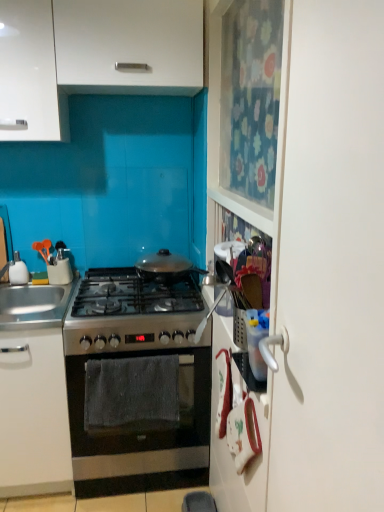
In order to face satin silver oven at center, which is counted as the 3th cabinetry, starting from the top, should I rotate leftwards or rightwards?

To face it directly, rotate left by 21.306 degrees.

Identify the location of white glossy soap dispenser at left. click(x=18, y=271).

In order to face stainless steel gas stove at center, should I rotate leftwards or rightwards?

You should rotate left by 7.017 degrees.

What do you see at coordinates (30, 74) in the screenshot? I see `white glossy cabinet at upper left, which is the 2th cabinetry from bottom to top` at bounding box center [30, 74].

Find the location of `satin silver oven at center, the first cabinetry in the bottom-to-top sequence`. satin silver oven at center, the first cabinetry in the bottom-to-top sequence is located at coordinates (34, 414).

Considering the positions of objects white glossy soap dispenser at left and silver metallic sink at left in the image provided, who is more to the left, white glossy soap dispenser at left or silver metallic sink at left?

white glossy soap dispenser at left is more to the left.

Is white glossy soap dispenser at left in front of silver metallic sink at left?

No.

From a real-world perspective, which object rests below the other?

From a 3D spatial view, silver metallic sink at left is below.

Is white glossy soap dispenser at left shorter than silver metallic sink at left?

Incorrect, the height of white glossy soap dispenser at left does not fall short of that of silver metallic sink at left.

Which object is further away from the camera taking this photo, stainless steel gas stove at center or silver metallic sink at left?

silver metallic sink at left.

Between stainless steel gas stove at center and silver metallic sink at left, which one has smaller size?

silver metallic sink at left is smaller.

Does point (184, 345) appear closer or farther from the camera than point (10, 328)?

Point (184, 345) is farther from the camera than point (10, 328).

From a real-world perspective, is stainless steel gas stove at center below silver metallic sink at left?

Incorrect, from a real-world perspective, stainless steel gas stove at center is higher than silver metallic sink at left.

Locate an element on the screen. cabinetry that is the 1st one when counting forward from the stainless steel gas stove at center is located at coordinates (129, 46).

From a real-world perspective, which object stands above the other?

white matte cabinet at upper left, the third cabinetry in the bottom-to-top sequence, from a real-world perspective.

Is stainless steel gas stove at center far from white matte cabinet at upper left, the third cabinetry in the bottom-to-top sequence?

No, there isn't a large distance between stainless steel gas stove at center and white matte cabinet at upper left, the third cabinetry in the bottom-to-top sequence.

This screenshot has height=512, width=384. I want to click on gas stove above the satin silver oven at center, which is counted as the 3th cabinetry, starting from the top (from the image's perspective), so click(131, 313).

Which of these two, stainless steel gas stove at center or satin silver oven at center, which is counted as the 3th cabinetry, starting from the top, is smaller?

stainless steel gas stove at center.

Which of these two, stainless steel gas stove at center or satin silver oven at center, the first cabinetry in the bottom-to-top sequence, stands shorter?

stainless steel gas stove at center.

From a real-world perspective, is stainless steel gas stove at center physically above satin silver oven at center, which is counted as the 3th cabinetry, starting from the top?

Yes, from a real-world perspective, stainless steel gas stove at center is above satin silver oven at center, which is counted as the 3th cabinetry, starting from the top.

Considering the positions of objects satin silver oven at center, the first cabinetry in the bottom-to-top sequence, and white glossy cabinet at upper left, which is the 2th cabinetry from bottom to top, in the image provided, who is more to the right, satin silver oven at center, the first cabinetry in the bottom-to-top sequence, or white glossy cabinet at upper left, which is the 2th cabinetry from bottom to top,?

Positioned to the right is white glossy cabinet at upper left, which is the 2th cabinetry from bottom to top.

How many degrees apart are the facing directions of satin silver oven at center, which is counted as the 3th cabinetry, starting from the top, and white glossy cabinet at upper left, the second cabinetry when ordered from top to bottom?

The facing directions of satin silver oven at center, which is counted as the 3th cabinetry, starting from the top, and white glossy cabinet at upper left, the second cabinetry when ordered from top to bottom, are 0.325 degrees apart.

Considering the sizes of objects satin silver oven at center, the first cabinetry in the bottom-to-top sequence, and white glossy cabinet at upper left, which is the 2th cabinetry from bottom to top, in the image provided, who is shorter, satin silver oven at center, the first cabinetry in the bottom-to-top sequence, or white glossy cabinet at upper left, which is the 2th cabinetry from bottom to top,?

With less height is white glossy cabinet at upper left, which is the 2th cabinetry from bottom to top.

Is satin silver oven at center, which is counted as the 3th cabinetry, starting from the top, thinner than white glossy cabinet at upper left, the second cabinetry when ordered from top to bottom?

No.

From the image's perspective, between stainless steel oven at center and white glossy cabinet at upper left, which is the 2th cabinetry from bottom to top, who is located below?

stainless steel oven at center, from the image's perspective.

In terms of height, does stainless steel oven at center look taller or shorter compared to white glossy cabinet at upper left, the second cabinetry when ordered from top to bottom?

In the image, stainless steel oven at center appears to be taller than white glossy cabinet at upper left, the second cabinetry when ordered from top to bottom.

Is stainless steel oven at center positioned with its back to white glossy cabinet at upper left, which is the 2th cabinetry from bottom to top?

stainless steel oven at center is not turned away from white glossy cabinet at upper left, which is the 2th cabinetry from bottom to top.

In the image, is stainless steel oven at center on the left side or the right side of white glossy cabinet at upper left, the second cabinetry when ordered from top to bottom?

stainless steel oven at center is positioned on white glossy cabinet at upper left, the second cabinetry when ordered from top to bottom,'s right side.

Does white glossy cabinet at upper left, which is the 2th cabinetry from bottom to top, appear on the left side of satin silver oven at center, the first cabinetry in the bottom-to-top sequence?

No, white glossy cabinet at upper left, which is the 2th cabinetry from bottom to top, is not to the left of satin silver oven at center, the first cabinetry in the bottom-to-top sequence.

Identify the location of the 1st cabinetry behind the white glossy cabinet at upper left, which is the 2th cabinetry from bottom to top, starting your count from the anchor. This screenshot has height=512, width=384. (34, 414).

Which of these two, white glossy cabinet at upper left, the second cabinetry when ordered from top to bottom, or satin silver oven at center, which is counted as the 3th cabinetry, starting from the top, stands shorter?

With less height is white glossy cabinet at upper left, the second cabinetry when ordered from top to bottom.

Considering the sizes of objects white glossy cabinet at upper left, the second cabinetry when ordered from top to bottom, and satin silver oven at center, the first cabinetry in the bottom-to-top sequence, in the image provided, who is smaller, white glossy cabinet at upper left, the second cabinetry when ordered from top to bottom, or satin silver oven at center, the first cabinetry in the bottom-to-top sequence,?

white glossy cabinet at upper left, the second cabinetry when ordered from top to bottom.

Where is `appliance positioned vertically above the silver metallic sink at left (from a real-world perspective)`? appliance positioned vertically above the silver metallic sink at left (from a real-world perspective) is located at coordinates (18, 271).

Locate an element on the screen. Image resolution: width=384 pixels, height=512 pixels. gas stove on the right of silver metallic sink at left is located at coordinates (131, 313).

From the image, which object appears to be nearer to stainless steel gas stove at center, white matte cabinet at upper left, the third cabinetry in the bottom-to-top sequence, or stainless steel oven at center?

The object closer to stainless steel gas stove at center is stainless steel oven at center.

From the image, which object appears to be farther from stainless steel gas stove at center, white glossy soap dispenser at left or satin silver oven at center, the first cabinetry in the bottom-to-top sequence?

The object further to stainless steel gas stove at center is white glossy soap dispenser at left.

Which object lies further to the anchor point stainless steel oven at center, white glossy soap dispenser at left or stainless steel gas stove at center?

The object further to stainless steel oven at center is white glossy soap dispenser at left.

Estimate the real-world distances between objects in this image. Which object is closer to silver metallic sink at left, white glossy cabinet at upper left, the second cabinetry when ordered from top to bottom, or white glossy soap dispenser at left?

The object closer to silver metallic sink at left is white glossy soap dispenser at left.

When comparing their distances from silver metallic sink at left, does white matte cabinet at upper left, the third cabinetry in the bottom-to-top sequence, or satin silver oven at center, the first cabinetry in the bottom-to-top sequence, seem further?

The object further to silver metallic sink at left is white matte cabinet at upper left, the third cabinetry in the bottom-to-top sequence.

Which object lies nearer to the anchor point satin silver oven at center, which is counted as the 3th cabinetry, starting from the top, white glossy soap dispenser at left or stainless steel gas stove at center?

stainless steel gas stove at center is positioned closer to the anchor satin silver oven at center, which is counted as the 3th cabinetry, starting from the top.

Based on their spatial positions, is silver metallic sink at left or stainless steel gas stove at center further from satin silver oven at center, the first cabinetry in the bottom-to-top sequence?

The object further to satin silver oven at center, the first cabinetry in the bottom-to-top sequence, is silver metallic sink at left.

Estimate the real-world distances between objects in this image. Which object is further from white glossy cabinet at upper left, which is the 2th cabinetry from bottom to top, stainless steel gas stove at center or silver metallic sink at left?

silver metallic sink at left lies further to white glossy cabinet at upper left, which is the 2th cabinetry from bottom to top, than the other object.

You are a GUI agent. You are given a task and a screenshot of the screen. Output one action in this format:
    pyautogui.click(x=<x>, y=<y>)
    Task: Click on the appliance that lies between white glossy cabinet at upper left, the second cabinetry when ordered from top to bottom, and silver metallic sink at left from top to bottom
    This screenshot has width=384, height=512.
    Given the screenshot: What is the action you would take?
    pyautogui.click(x=18, y=271)

I want to click on sink situated between white glossy soap dispenser at left and stainless steel gas stove at center from left to right, so click(x=34, y=305).

Locate an element on the screen. Image resolution: width=384 pixels, height=512 pixels. gas stove that lies between white glossy cabinet at upper left, the second cabinetry when ordered from top to bottom, and satin silver oven at center, which is counted as the 3th cabinetry, starting from the top, from top to bottom is located at coordinates (131, 313).

At what (x,y) coordinates should I click in order to perform the action: click on appliance between white matte cabinet at upper left, which is the 1th cabinetry from top to bottom, and satin silver oven at center, the first cabinetry in the bottom-to-top sequence, from top to bottom. Please return your answer as a coordinate pair (x, y). This screenshot has height=512, width=384. Looking at the image, I should click on (18, 271).